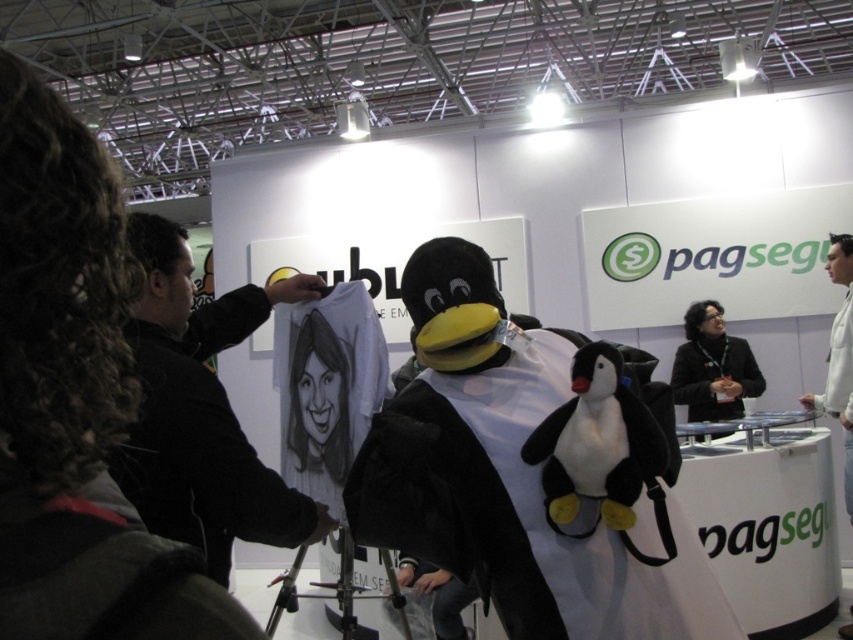
Question: Is velvet black penguin at center closer to camera compared to white paper at center?

Choices:
 (A) yes
 (B) no

Answer: (B)

Question: Can you confirm if white paper at center is positioned to the right of black plush penguin at center?

Choices:
 (A) no
 (B) yes

Answer: (A)

Question: Which of these objects is positioned farthest from the velvet black penguin at center?

Choices:
 (A) black plush penguin at center
 (B) white paper at center
 (C) black fabric at center

Answer: (C)

Question: Can you confirm if black plush penguin at center is positioned to the left of black fabric at center?

Choices:
 (A) yes
 (B) no

Answer: (A)

Question: Which object appears farthest from the camera in this image?

Choices:
 (A) white paper at center
 (B) black fabric at center
 (C) black plush penguin at center

Answer: (B)

Question: Which point is closer to the camera?

Choices:
 (A) black plush penguin at center
 (B) black fabric at center
 (C) white paper at center

Answer: (C)